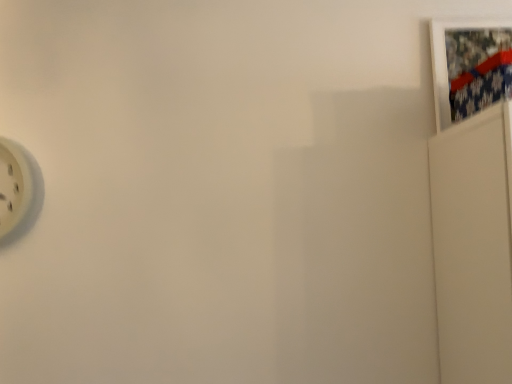
Question: Are white matte picture frame at upper right and white plastic wall clock at left located far from each other?

Choices:
 (A) no
 (B) yes

Answer: (B)

Question: Is white matte picture frame at upper right to the left of white plastic wall clock at left from the viewer's perspective?

Choices:
 (A) no
 (B) yes

Answer: (A)

Question: Considering the relative sizes of white matte picture frame at upper right and white plastic wall clock at left in the image provided, is white matte picture frame at upper right thinner than white plastic wall clock at left?

Choices:
 (A) yes
 (B) no

Answer: (A)

Question: Can you confirm if white matte picture frame at upper right is smaller than white plastic wall clock at left?

Choices:
 (A) yes
 (B) no

Answer: (A)

Question: From the image's perspective, is white matte picture frame at upper right on top of white plastic wall clock at left?

Choices:
 (A) yes
 (B) no

Answer: (A)

Question: Is white matte picture frame at upper right wider than white plastic wall clock at left?

Choices:
 (A) yes
 (B) no

Answer: (B)

Question: Can you confirm if white plastic wall clock at left is thinner than white matte picture frame at upper right?

Choices:
 (A) yes
 (B) no

Answer: (B)

Question: Is white plastic wall clock at left closer to camera compared to white matte picture frame at upper right?

Choices:
 (A) no
 (B) yes

Answer: (B)

Question: From the image's perspective, is white plastic wall clock at left on top of white matte picture frame at upper right?

Choices:
 (A) no
 (B) yes

Answer: (A)

Question: Could you tell me if white plastic wall clock at left is facing white matte picture frame at upper right?

Choices:
 (A) yes
 (B) no

Answer: (B)

Question: Are white plastic wall clock at left and white matte picture frame at upper right located far from each other?

Choices:
 (A) yes
 (B) no

Answer: (A)

Question: Considering the relative positions of white plastic wall clock at left and white matte picture frame at upper right in the image provided, is white plastic wall clock at left behind white matte picture frame at upper right?

Choices:
 (A) yes
 (B) no

Answer: (B)

Question: Is white plastic wall clock at left taller or shorter than white matte picture frame at upper right?

Choices:
 (A) tall
 (B) short

Answer: (B)